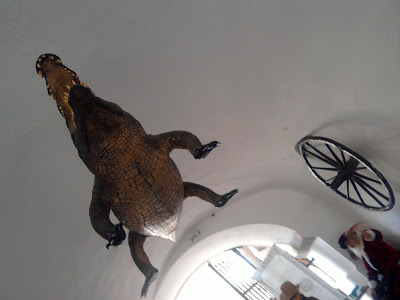
Identify the location of white curved ceiling on left of aligator image. The height and width of the screenshot is (300, 400). (38, 133), (33, 185).